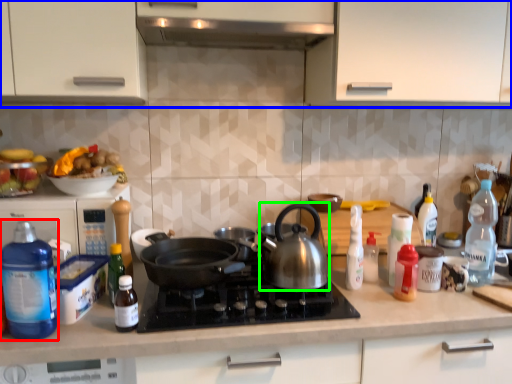
Question: Which object is the farthest from bottle (highlighted by a red box)? Choose among these: cabinetry (highlighted by a blue box) or kitchen appliance (highlighted by a green box).

Choices:
 (A) cabinetry
 (B) kitchen appliance

Answer: (A)